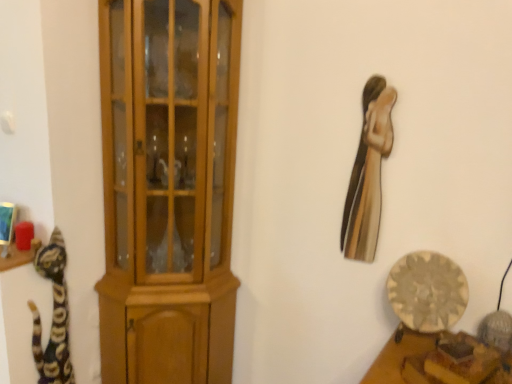
Question: Should I look upward or downward to see metallic gold statue at upper right?

Choices:
 (A) down
 (B) up

Answer: (B)

Question: Considering the relative positions of wooden plate at lower right and multicolored fur cat at left in the image provided, is wooden plate at lower right to the left of multicolored fur cat at left from the viewer's perspective?

Choices:
 (A) yes
 (B) no

Answer: (B)

Question: Considering the relative sizes of wooden plate at lower right and multicolored fur cat at left in the image provided, is wooden plate at lower right wider than multicolored fur cat at left?

Choices:
 (A) yes
 (B) no

Answer: (A)

Question: Is wooden plate at lower right completely or partially outside of multicolored fur cat at left?

Choices:
 (A) no
 (B) yes

Answer: (B)

Question: Is wooden plate at lower right looking in the opposite direction of multicolored fur cat at left?

Choices:
 (A) no
 (B) yes

Answer: (A)

Question: Would you consider wooden plate at lower right to be distant from multicolored fur cat at left?

Choices:
 (A) no
 (B) yes

Answer: (B)

Question: From the image's perspective, would you say wooden plate at lower right is positioned over multicolored fur cat at left?

Choices:
 (A) no
 (B) yes

Answer: (B)

Question: Does wooden plate at lower right have a smaller size compared to metallic gold statue at upper right?

Choices:
 (A) no
 (B) yes

Answer: (A)

Question: Does wooden plate at lower right come in front of metallic gold statue at upper right?

Choices:
 (A) no
 (B) yes

Answer: (B)

Question: Considering the relative positions of wooden plate at lower right and metallic gold statue at upper right in the image provided, is wooden plate at lower right to the left of metallic gold statue at upper right from the viewer's perspective?

Choices:
 (A) no
 (B) yes

Answer: (A)

Question: From a real-world perspective, is wooden plate at lower right on top of metallic gold statue at upper right?

Choices:
 (A) yes
 (B) no

Answer: (B)

Question: From the image's perspective, is wooden plate at lower right located beneath metallic gold statue at upper right?

Choices:
 (A) no
 (B) yes

Answer: (B)

Question: Can we say wooden plate at lower right lies outside metallic gold statue at upper right?

Choices:
 (A) no
 (B) yes

Answer: (B)

Question: Does multicolored fur cat at left have a greater height compared to metallic gold statue at upper right?

Choices:
 (A) yes
 (B) no

Answer: (A)